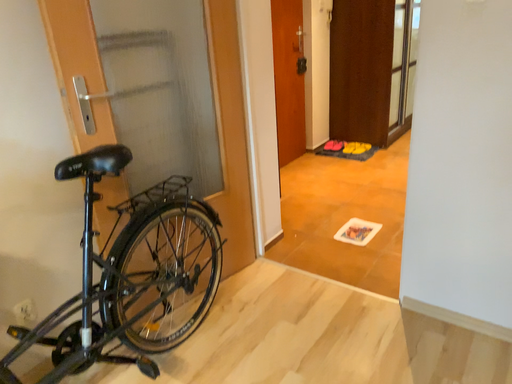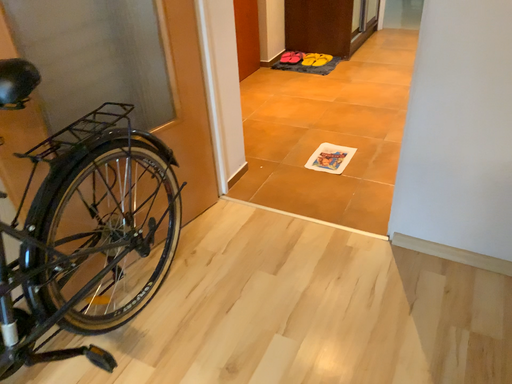
Question: Which way did the camera rotate in the video?

Choices:
 (A) rotated downward
 (B) rotated upward

Answer: (A)